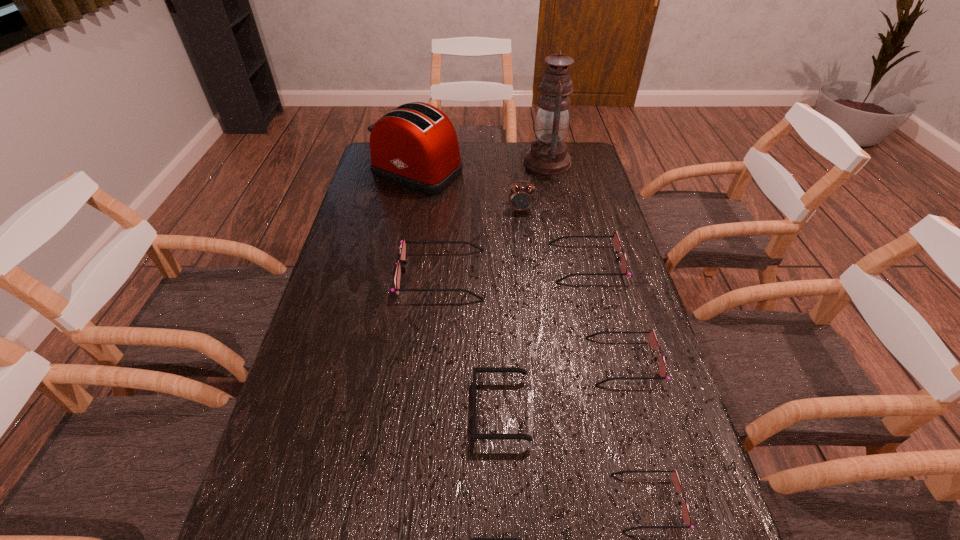
Locate an element on the screen. The image size is (960, 540). the second nearest pink sunglasses is located at coordinates (652, 339).

At what (x,y) coordinates should I click in order to perform the action: click on the bigger black sunglasses. Please return your answer as a coordinate pair (x, y). Looking at the image, I should click on 476,370.

The image size is (960, 540). I want to click on the eighth farthest object, so click(x=674, y=475).

Locate an element on the screen. The height and width of the screenshot is (540, 960). the nearest pink sunglasses is located at coordinates (674, 475).

Where is `free location located on the front of the oil lamp`? The height and width of the screenshot is (540, 960). free location located on the front of the oil lamp is located at coordinates (553, 192).

Locate an element on the screen. The width and height of the screenshot is (960, 540). free space located on the right of the eighth shortest object is located at coordinates (544, 173).

Where is `vacant space located 0.260m on the face of the alarm clock`? This screenshot has height=540, width=960. vacant space located 0.260m on the face of the alarm clock is located at coordinates (527, 266).

Image resolution: width=960 pixels, height=540 pixels. What are the coordinates of `free space located on the bridge of the sixth shortest object` in the screenshot? It's located at (515, 274).

Identify the location of vacant space located on the bridge of the fifth shortest sunglasses. The width and height of the screenshot is (960, 540). (512, 262).

Image resolution: width=960 pixels, height=540 pixels. In order to click on free space located on the bridge of the fifth shortest sunglasses in this screenshot , I will do `click(529, 262)`.